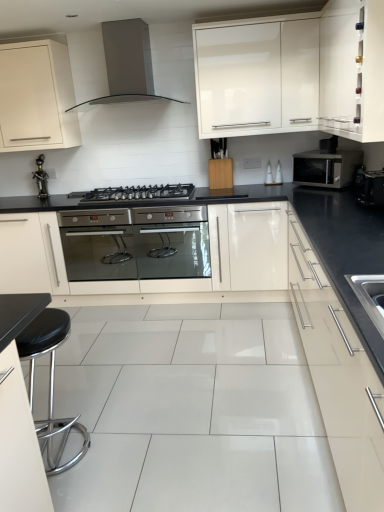
This screenshot has height=512, width=384. Identify the location of metallic figurine at left. (41, 178).

Measure the distance between metallic figurine at left and camera.

metallic figurine at left is 12.49 feet from camera.

Image resolution: width=384 pixels, height=512 pixels. Find the location of `stainless steel oven at center`. stainless steel oven at center is located at coordinates (137, 250).

What is the approximate height of stainless steel oven at center?

It is 60.37 centimeters.

Describe the element at coordinates (326, 167) in the screenshot. I see `satin silver microwave at right` at that location.

You are a GUI agent. You are given a task and a screenshot of the screen. Output one action in this format:
    pyautogui.click(x=<x>, y=<y>)
    Task: Click on the black plastic toaster at right
    
    Given the screenshot: What is the action you would take?
    pyautogui.click(x=372, y=188)

What do you see at coordinates (238, 77) in the screenshot?
I see `glossy white cabinet at upper center` at bounding box center [238, 77].

I want to click on glossy white cabinet at upper center, so click(238, 77).

Describe the element at coordinates (220, 173) in the screenshot. I see `wooden knife block at center, the 2th cabinetry in the left-to-right sequence` at that location.

Find the location of a particular element. metallic figurine at left is located at coordinates (41, 178).

Considering the relative sizes of stainless steel oven at center and wooden knife block at center, the 2th cabinetry in the left-to-right sequence, in the image provided, is stainless steel oven at center smaller than wooden knife block at center, the 2th cabinetry in the left-to-right sequence,?

No, stainless steel oven at center is not smaller than wooden knife block at center, the 2th cabinetry in the left-to-right sequence.

Is stainless steel oven at center inside the boundaries of wooden knife block at center, which appears as the third cabinetry when viewed from the right, or outside?

stainless steel oven at center is spatially situated outside wooden knife block at center, which appears as the third cabinetry when viewed from the right.

Considering the relative positions of stainless steel oven at center and wooden knife block at center, which appears as the third cabinetry when viewed from the right, in the image provided, is stainless steel oven at center to the right of wooden knife block at center, which appears as the third cabinetry when viewed from the right, from the viewer's perspective?

No, stainless steel oven at center is not to the right of wooden knife block at center, which appears as the third cabinetry when viewed from the right.

From the image's perspective, is stainless steel oven at center below wooden knife block at center, which appears as the third cabinetry when viewed from the right?

Yes, from the image's perspective, stainless steel oven at center is beneath wooden knife block at center, which appears as the third cabinetry when viewed from the right.

Relative to stainless steel oven at center, is satin silver microwave at right in front or behind?

Clearly, satin silver microwave at right is in front of stainless steel oven at center.

Looking at this image, is satin silver microwave at right smaller than stainless steel oven at center?

Correct, satin silver microwave at right occupies less space than stainless steel oven at center.

How many degrees apart are the facing directions of satin silver microwave at right and stainless steel oven at center?

The facing directions of satin silver microwave at right and stainless steel oven at center are 47.6 degrees apart.

This screenshot has width=384, height=512. In order to click on oven that appears behind the satin silver microwave at right in this screenshot , I will do `click(137, 250)`.

Looking at this image, from the image's perspective, which is below, black plastic toaster at right or metallic figurine at left?

From the image's view, black plastic toaster at right is below.

Is black plastic toaster at right with metallic figurine at left?

They are not placed beside each other.

From the picture: Is black plastic toaster at right wider or thinner than metallic figurine at left?

Considering their sizes, black plastic toaster at right looks broader than metallic figurine at left.

This screenshot has height=512, width=384. Find the location of `faucet lying on the left of black plastic toaster at right`. faucet lying on the left of black plastic toaster at right is located at coordinates (41, 178).

Does point (373, 173) appear closer or farther from the camera than point (176, 187)?

Point (373, 173) is positioned closer to the camera compared to point (176, 187).

From a real-world perspective, does black plastic toaster at right sit lower than black matte gas stove at center?

No, from a real-world perspective, black plastic toaster at right is not beneath black matte gas stove at center.

Is black matte gas stove at center inside black plastic toaster at right?

No, black plastic toaster at right does not contain black matte gas stove at center.

Which of these two, satin metallic range hood at upper center or satin silver drawer at right, the second cabinetry viewed from the right, stands shorter?

satin metallic range hood at upper center is shorter.

Between satin metallic range hood at upper center and satin silver drawer at right, the third cabinetry positioned from the left, which one appears on the right side from the viewer's perspective?

satin silver drawer at right, the third cabinetry positioned from the left, is more to the right.

Considering the sizes of objects satin metallic range hood at upper center and satin silver drawer at right, the second cabinetry viewed from the right, in the image provided, who is smaller, satin metallic range hood at upper center or satin silver drawer at right, the second cabinetry viewed from the right,?

satin metallic range hood at upper center.

Based on the photo, from a real-world perspective, who is located higher, satin metallic range hood at upper center or satin silver drawer at right, the third cabinetry positioned from the left?

satin metallic range hood at upper center, from a real-world perspective.

Is white glossy cabinet at upper left, the 4th cabinetry when ordered from right to left, shorter than satin silver microwave at right?

Incorrect, the height of white glossy cabinet at upper left, the 4th cabinetry when ordered from right to left, does not fall short of that of satin silver microwave at right.

Is white glossy cabinet at upper left, the 4th cabinetry when ordered from right to left, not within satin silver microwave at right?

Yes, white glossy cabinet at upper left, the 4th cabinetry when ordered from right to left, is not within satin silver microwave at right.

Is the surface of white glossy cabinet at upper left, the 4th cabinetry when ordered from right to left, in direct contact with satin silver microwave at right?

No, white glossy cabinet at upper left, the 4th cabinetry when ordered from right to left, is not beside satin silver microwave at right.

Considering the sizes of white glossy cabinet at upper left, placed as the 1th cabinetry when sorted from left to right, and satin silver microwave at right in the image, is white glossy cabinet at upper left, placed as the 1th cabinetry when sorted from left to right, bigger or smaller than satin silver microwave at right?

Considering their sizes, white glossy cabinet at upper left, placed as the 1th cabinetry when sorted from left to right, takes up more space than satin silver microwave at right.

Is point (315, 178) positioned after point (367, 199)?

Yes, it is behind point (367, 199).

Can you confirm if satin silver microwave at right is thinner than black plastic toaster at right?

Incorrect, the width of satin silver microwave at right is not less than that of black plastic toaster at right.

Considering the relative sizes of satin silver microwave at right and black plastic toaster at right in the image provided, is satin silver microwave at right taller than black plastic toaster at right?

Indeed, satin silver microwave at right has a greater height compared to black plastic toaster at right.

Is satin silver microwave at right bigger than black plastic toaster at right?

Indeed, satin silver microwave at right has a larger size compared to black plastic toaster at right.

You are a GUI agent. You are given a task and a screenshot of the screen. Output one action in this format:
    pyautogui.click(x=<x>, y=<y>)
    Task: Click on the oven below the wooden knife block at center, the 2th cabinetry in the left-to-right sequence (from a real-world perspective)
    
    Given the screenshot: What is the action you would take?
    pyautogui.click(x=137, y=250)

At what (x,y) coordinates should I click in order to perform the action: click on microwave oven above the stainless steel oven at center (from the image's perspective). Please return your answer as a coordinate pair (x, y). Image resolution: width=384 pixels, height=512 pixels. Looking at the image, I should click on (326, 167).

Looking at the image, which one is located closer to wooden knife block at center, which appears as the third cabinetry when viewed from the right, metallic figurine at left or white glossy cabinet at upper left, placed as the 1th cabinetry when sorted from left to right?

white glossy cabinet at upper left, placed as the 1th cabinetry when sorted from left to right, is closer to wooden knife block at center, which appears as the third cabinetry when viewed from the right.

Which object lies nearer to the anchor point black matte gas stove at center, wooden knife block at center, which appears as the third cabinetry when viewed from the right, or satin silver drawer at right, the third cabinetry positioned from the left?

wooden knife block at center, which appears as the third cabinetry when viewed from the right.

Looking at this image, looking at the image, which one is located further to satin silver drawer at right, the third cabinetry positioned from the left, black matte gas stove at center or stainless steel oven at center?

Based on the image, black matte gas stove at center appears to be further to satin silver drawer at right, the third cabinetry positioned from the left.

Estimate the real-world distances between objects in this image. Which object is further from white glossy cabinet at upper left, placed as the 1th cabinetry when sorted from left to right, white glossy cabinet at upper right, placed as the first cabinetry when sorted from right to left, or black leather seat at lower left?

The object further to white glossy cabinet at upper left, placed as the 1th cabinetry when sorted from left to right, is white glossy cabinet at upper right, placed as the first cabinetry when sorted from right to left.

Looking at the image, which one is located further to satin metallic range hood at upper center, wooden knife block at center, which appears as the third cabinetry when viewed from the right, or metallic figurine at left?

metallic figurine at left.

Looking at the image, which one is located further to wooden knife block at center, which appears as the third cabinetry when viewed from the right, satin silver microwave at right or black leather seat at lower left?

black leather seat at lower left lies further to wooden knife block at center, which appears as the third cabinetry when viewed from the right, than the other object.

From the image, which object appears to be farther from metallic figurine at left, black leather seat at lower left or black plastic toaster at right?

black plastic toaster at right lies further to metallic figurine at left than the other object.

Which object lies further to the anchor point satin silver drawer at right, the third cabinetry positioned from the left, glossy white cabinet at upper center or stainless steel oven at center?

Among the two, stainless steel oven at center is located further to satin silver drawer at right, the third cabinetry positioned from the left.

The image size is (384, 512). What are the coordinates of `gas stove positioned between black leather seat at lower left and stainless steel oven at center from near to far` in the screenshot? It's located at (135, 193).

Identify the location of faucet situated between white glossy cabinet at upper left, the 4th cabinetry when ordered from right to left, and black plastic toaster at right from left to right. The image size is (384, 512). (41, 178).

Locate an element on the screen. Image resolution: width=384 pixels, height=512 pixels. faucet between satin metallic range hood at upper center and stainless steel oven at center in the up-down direction is located at coordinates (41, 178).

Locate an element on the screen. home appliance between metallic figurine at left and black plastic toaster at right is located at coordinates (126, 65).